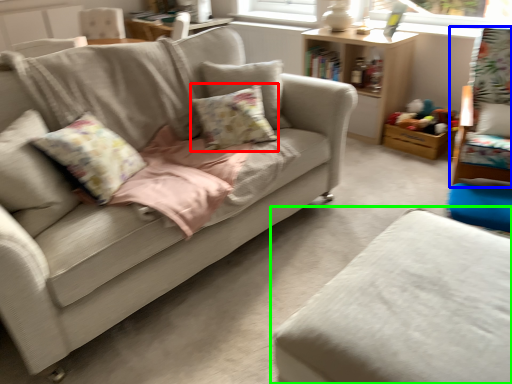
Question: Which is nearer to the pillow (highlighted by a red box)? swivel chair (highlighted by a blue box) or studio couch (highlighted by a green box).

Choices:
 (A) swivel chair
 (B) studio couch

Answer: (B)